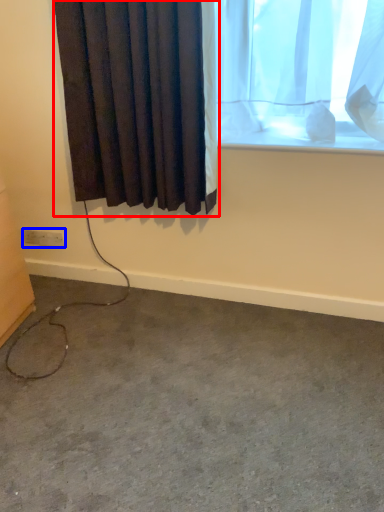
Question: Which object appears closest to the camera in this image, curtain (highlighted by a red box) or electric outlet (highlighted by a blue box)?

Choices:
 (A) curtain
 (B) electric outlet

Answer: (A)